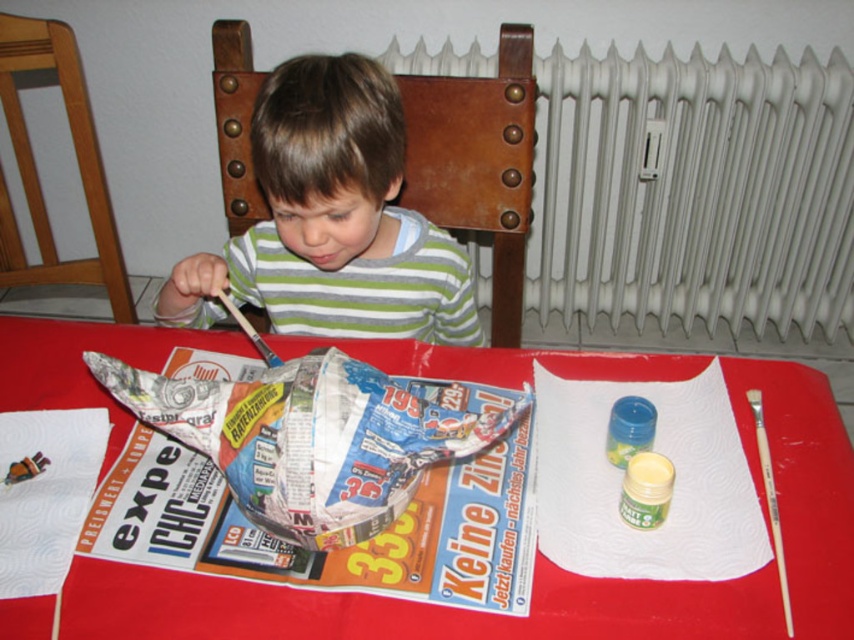
Question: Which point is farther from the camera taking this photo?

Choices:
 (A) (778, 372)
 (B) (447, 237)
 (C) (533, 65)

Answer: (C)

Question: Which point is closer to the camera taking this photo?

Choices:
 (A) (3, 51)
 (B) (734, 92)

Answer: (A)

Question: Is white metallic radiator at upper center below red paper table at center?

Choices:
 (A) no
 (B) yes

Answer: (A)

Question: Is white metallic radiator at upper center bigger than green striped shirt at center?

Choices:
 (A) yes
 (B) no

Answer: (A)

Question: Can you confirm if white metallic radiator at upper center is smaller than green striped shirt at center?

Choices:
 (A) no
 (B) yes

Answer: (A)

Question: Which object is positioned farthest from the white metallic radiator at upper center?

Choices:
 (A) wooden chair at left
 (B) red paper table at center
 (C) green striped shirt at center

Answer: (A)